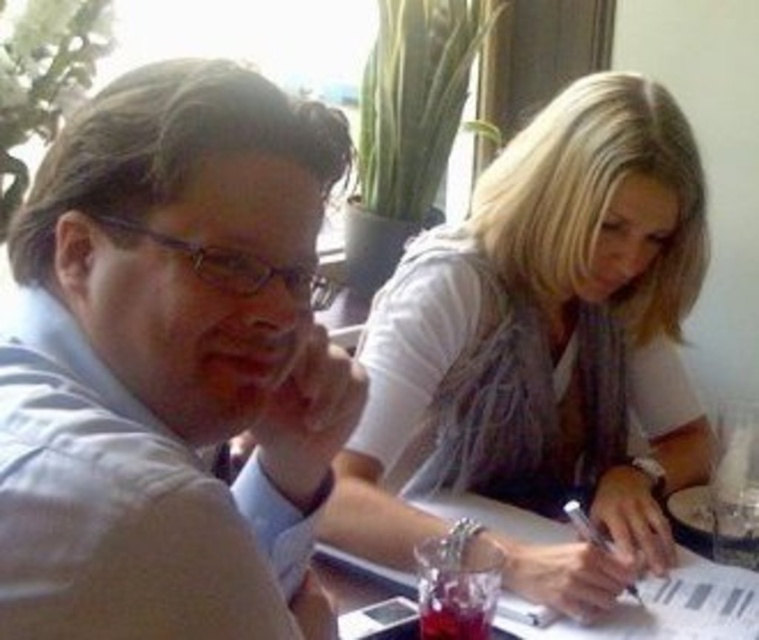
You are a photographer taking a picture of the scene. The white fabric shirt at upper right and the clear plastic table at center are both in your view. Which object is positioned higher from the ground?

The white fabric shirt at upper right is above the clear plastic table at center, so it is higher from the ground.